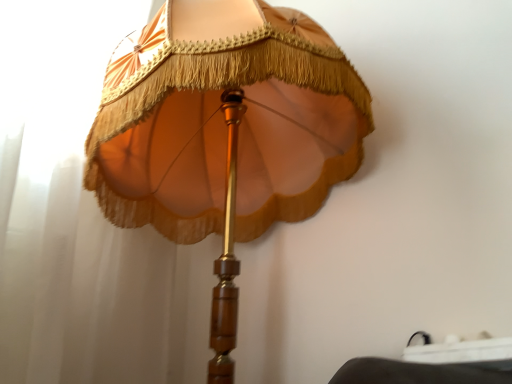
Describe the element at coordinates (224, 120) in the screenshot. The image size is (512, 384). I see `matte gold lampshade at upper center` at that location.

Where is `matte gold lampshade at upper center`? matte gold lampshade at upper center is located at coordinates (224, 120).

I want to click on matte gold lampshade at upper center, so click(224, 120).